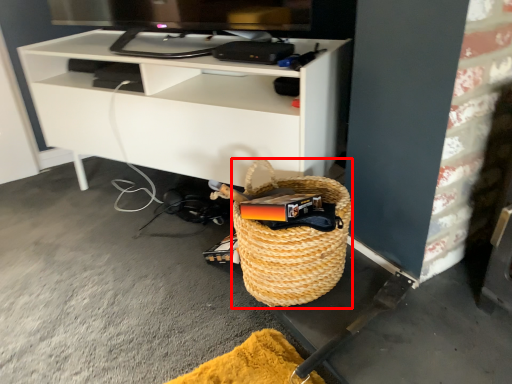
Question: Considering the relative positions of basket (annotated by the red box) and shelf in the image provided, where is basket (annotated by the red box) located with respect to the staircase?

Choices:
 (A) left
 (B) right

Answer: (B)